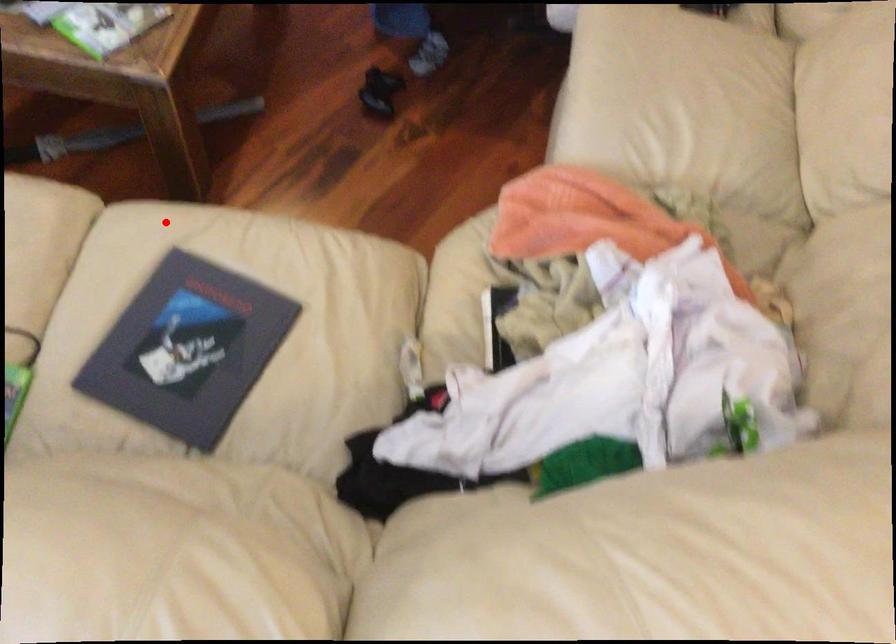
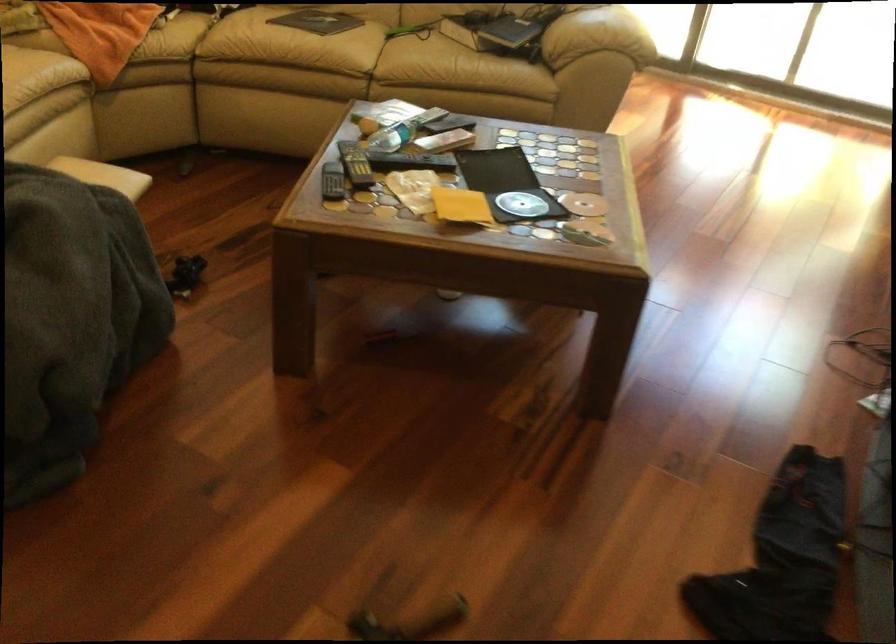
Question: I am providing you with two images of the same scene from different viewpoints. In image1, a red point is highlighted. Considering the same 3D point in image2, which of the following is correct?

Choices:
 (A) It is closer
 (B) It is farther

Answer: (B)